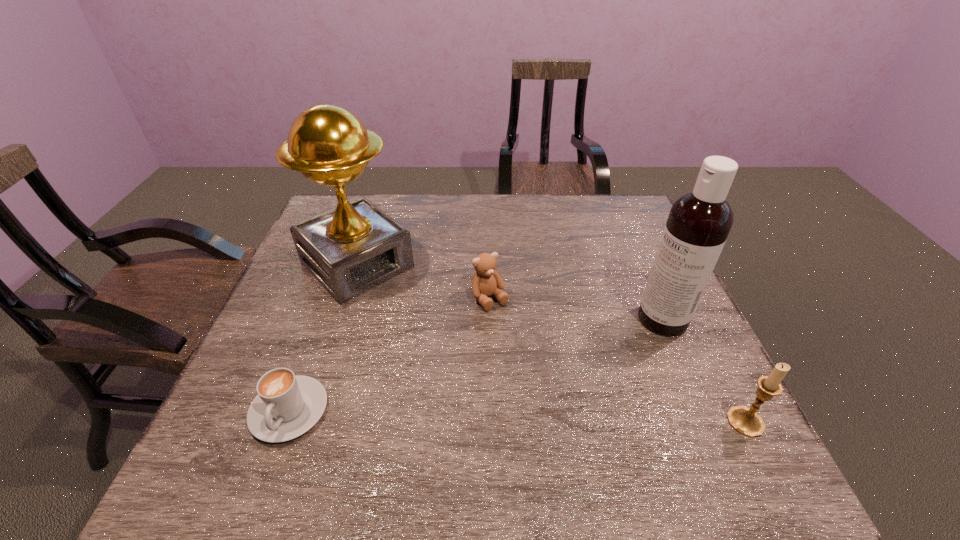
Where is `award situated at the left edge`? This screenshot has width=960, height=540. award situated at the left edge is located at coordinates (355, 247).

Where is `candle holder that is at the right edge`? candle holder that is at the right edge is located at coordinates (746, 421).

Find the location of a particular element. The height and width of the screenshot is (540, 960). dishwasher detergent located at the right edge is located at coordinates (699, 222).

Image resolution: width=960 pixels, height=540 pixels. Identify the location of object that is at the far left corner. (355, 247).

Find the location of a particular element. Image resolution: width=960 pixels, height=540 pixels. object that is at the near left corner is located at coordinates (287, 405).

At what (x,y) coordinates should I click in order to perform the action: click on object that is at the near right corner. Please return your answer as a coordinate pair (x, y). The width and height of the screenshot is (960, 540). Looking at the image, I should click on (746, 421).

Identify the location of vacant space at the far edge of the desktop. This screenshot has height=540, width=960. (424, 218).

The height and width of the screenshot is (540, 960). Identify the location of vacant point at the near edge. (610, 399).

At what (x,y) coordinates should I click in order to perform the action: click on free space at the left edge. Please return your answer as a coordinate pair (x, y). Looking at the image, I should click on (249, 355).

What are the coordinates of `free space at the right edge of the desktop` in the screenshot? It's located at (635, 267).